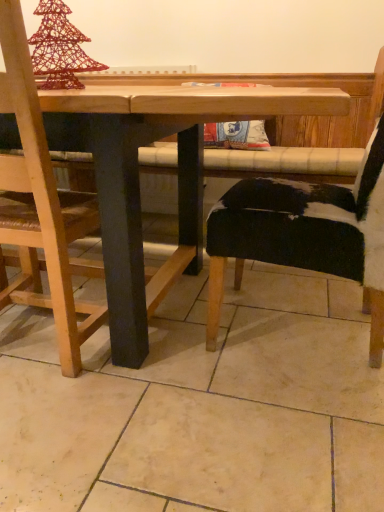
At what (x,y) coordinates should I click in order to perform the action: click on free area in between wooden chair at left, the 2th chair viewed from the right, and wooden table at center. Please return your answer as a coordinate pair (x, y). Looking at the image, I should click on (143, 393).